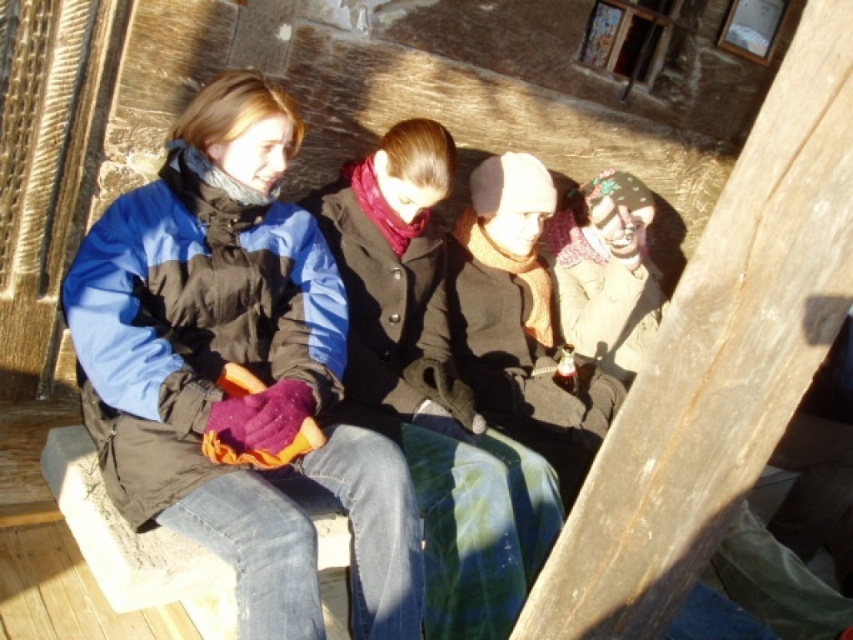
Does matte black jacket at center have a lesser width compared to velvet brown scarf at center?

No, matte black jacket at center is not thinner than velvet brown scarf at center.

Is matte black jacket at center wider than velvet brown scarf at center?

Yes.

The image size is (853, 640). I want to click on matte black jacket at center, so click(x=241, y=368).

This screenshot has height=640, width=853. Find the location of `matte black jacket at center`. matte black jacket at center is located at coordinates (241, 368).

Is velvet brown scarf at center below knitted wool hat at center?

Yes.

Is point (428, 360) closer to viewer compared to point (579, 460)?

That is True.

Is point (422, 336) closer to camera compared to point (563, 339)?

Yes, point (422, 336) is in front of point (563, 339).

The image size is (853, 640). In order to click on velvet brown scarf at center in this screenshot , I will do `click(432, 387)`.

Does matte black jacket at center have a lesser width compared to knitted wool hat at center?

In fact, matte black jacket at center might be wider than knitted wool hat at center.

Where is `matte black jacket at center`? matte black jacket at center is located at coordinates (241, 368).

Does point (120, 429) come behind point (519, 278)?

No, (120, 429) is in front of (519, 278).

You are a GUI agent. You are given a task and a screenshot of the screen. Output one action in this format:
    pyautogui.click(x=<x>, y=<y>)
    Task: Click on the matte black jacket at center
    
    Given the screenshot: What is the action you would take?
    pyautogui.click(x=241, y=368)